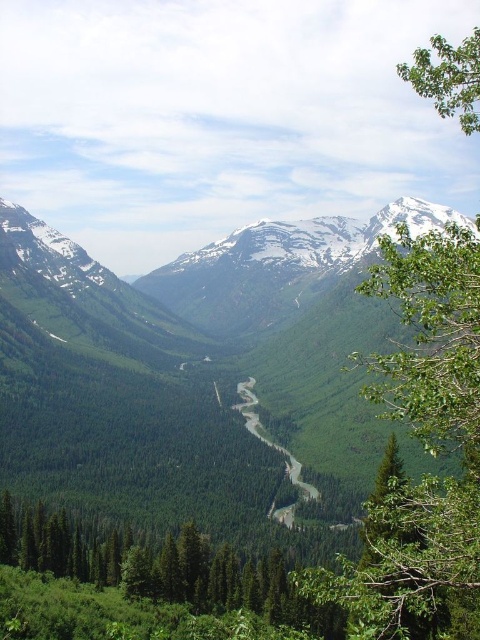
You are an observer looking at the mountain landscape. You see a green leafy tree at right and a green leafy tree at upper right. Which tree is closer to the left edge of the image?

The green leafy tree at right is positioned on the left side of green leafy tree at upper right, meaning it is closer to the left edge of the image.

You are a hiker standing at the bottom of the valley and looking up. You see the green leafy tree at right and the green leafy tree at upper right. Which tree is higher up in the valley?

The green leafy tree at upper right is higher up in the valley than the green leafy tree at right.

You are an environmental scientist analyzing the forest structure in this mountainous landscape. You observe the green leafy tree at right and the green leafy tree at upper right. Which tree has a wider canopy spread?

The green leafy tree at upper right has a wider canopy spread than the green leafy tree at right.